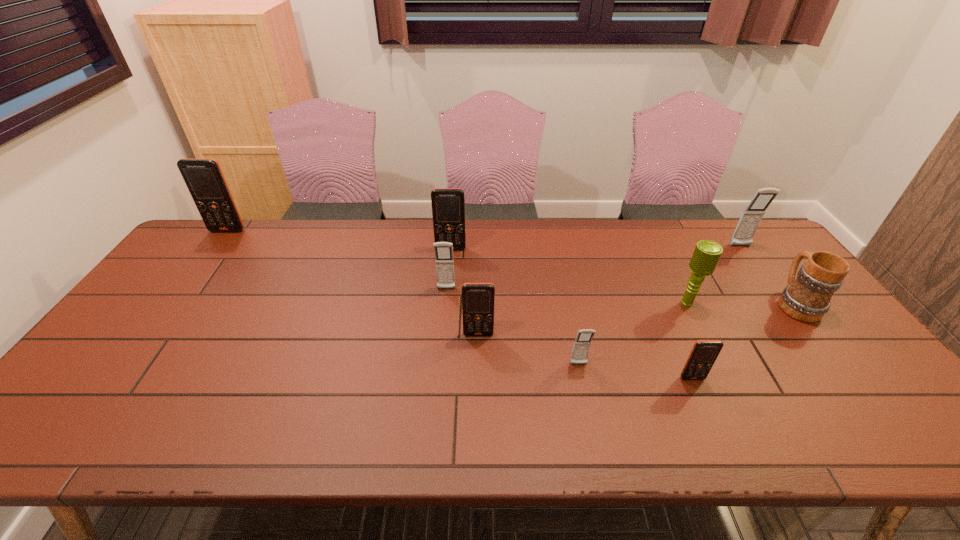
Image resolution: width=960 pixels, height=540 pixels. What are the coordinates of `object present at the far left corner` in the screenshot? It's located at (204, 179).

Where is `object positioned at the far right corner`? object positioned at the far right corner is located at coordinates (743, 235).

Image resolution: width=960 pixels, height=540 pixels. I want to click on vacant space at the far edge of the desktop, so click(x=311, y=231).

This screenshot has width=960, height=540. In the image, there is a desktop. What are the coordinates of `free space at the near edge` in the screenshot? It's located at (403, 430).

At what (x,y) coordinates should I click in order to perform the action: click on blank area at the far right corner. Please return your answer as a coordinate pair (x, y). This screenshot has width=960, height=540. Looking at the image, I should click on (759, 242).

Locate an element on the screen. This screenshot has height=540, width=960. vacant region between the mug and the microphone is located at coordinates (741, 303).

The width and height of the screenshot is (960, 540). I want to click on vacant point located between the fifth cellular telephone from left to right and the mug, so click(x=687, y=334).

Locate an element on the screen. The width and height of the screenshot is (960, 540). vacant space that is in between the second farthest orange cellular telephone and the sixth farthest cellular telephone is located at coordinates (515, 307).

At what (x,y) coordinates should I click in order to perform the action: click on free space between the tallest object and the fifth cellular telephone from left to right. Please return your answer as a coordinate pair (x, y). The height and width of the screenshot is (540, 960). Looking at the image, I should click on (403, 298).

The height and width of the screenshot is (540, 960). In order to click on vacant area that lies between the second biggest orange cellular telephone and the farthest orange cellular telephone in this screenshot , I will do `click(339, 240)`.